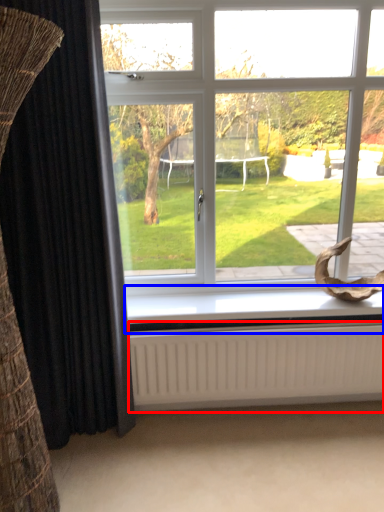
Question: Which object is closer to the camera taking this photo, radiator (highlighted by a red box) or window sill (highlighted by a blue box)?

Choices:
 (A) radiator
 (B) window sill

Answer: (A)